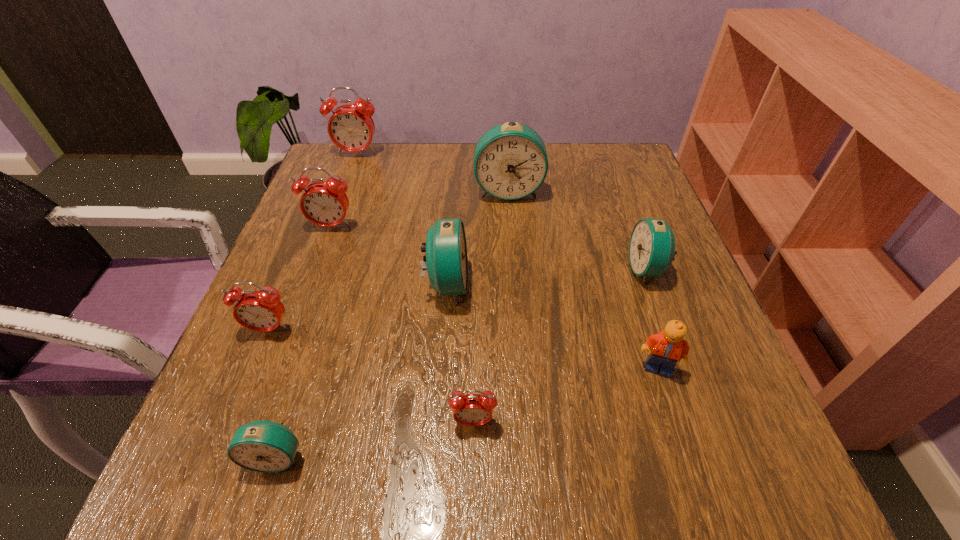
Identify the location of the third biggest red alarm clock. The image size is (960, 540). (262, 311).

The width and height of the screenshot is (960, 540). Find the location of `the third nearest object`. the third nearest object is located at coordinates (668, 347).

At what (x,y) coordinates should I click in order to perform the action: click on orange Lego. Please return your answer as a coordinate pair (x, y). The image size is (960, 540). Looking at the image, I should click on (668, 347).

The image size is (960, 540). Find the location of `the rightmost red alarm clock`. the rightmost red alarm clock is located at coordinates (471, 409).

Identify the location of the second nearest object. The height and width of the screenshot is (540, 960). (471, 409).

Locate an element on the screen. the nearest alarm clock is located at coordinates (265, 446).

You are a GUI agent. You are given a task and a screenshot of the screen. Output one action in this format:
    pyautogui.click(x=<x>, y=<y>)
    Task: Click on the leftmost blue alarm clock
    
    Given the screenshot: What is the action you would take?
    pyautogui.click(x=265, y=446)

Where is `vacant area situated 0.400m on the face of the biggest red alarm clock`? The width and height of the screenshot is (960, 540). vacant area situated 0.400m on the face of the biggest red alarm clock is located at coordinates (316, 266).

Where is `free space located 0.360m on the front-facing side of the third blue alarm clock from left to right`? This screenshot has width=960, height=540. free space located 0.360m on the front-facing side of the third blue alarm clock from left to right is located at coordinates (518, 327).

Identify the location of vacant space located 0.310m on the front-facing side of the second biggest blue alarm clock. (630, 285).